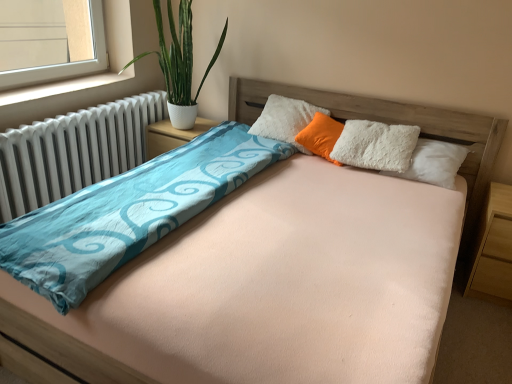
Question: Do you think white metallic radiator at left is within light brown wood at right, arranged as the 1th nightstand when viewed from the right, or outside of it?

Choices:
 (A) inside
 (B) outside

Answer: (B)

Question: Considering the positions of white metallic radiator at left and light brown wood at right, marked as the 1th nightstand in a front-to-back arrangement, in the image, is white metallic radiator at left taller or shorter than light brown wood at right, marked as the 1th nightstand in a front-to-back arrangement,?

Choices:
 (A) short
 (B) tall

Answer: (B)

Question: Which of these objects is positioned closest to the white textured nightstand at center, arranged as the second nightstand when ordered from the bottom?

Choices:
 (A) white fluffy pillow at center
 (B) green leafy plant in white pot at left
 (C) white metallic radiator at left
 (D) light brown wood at right, marked as the 1th nightstand in a bottom-to-top arrangement
 (E) white plastic window sill at left

Answer: (B)

Question: Which object is the farthest from the light brown wood at right, arranged as the 1th nightstand when viewed from the right?

Choices:
 (A) green leafy plant in white pot at left
 (B) white fluffy pillow at center
 (C) white metallic radiator at left
 (D) white plastic window sill at left
 (E) white textured nightstand at center, arranged as the 1th nightstand when viewed from the top

Answer: (D)